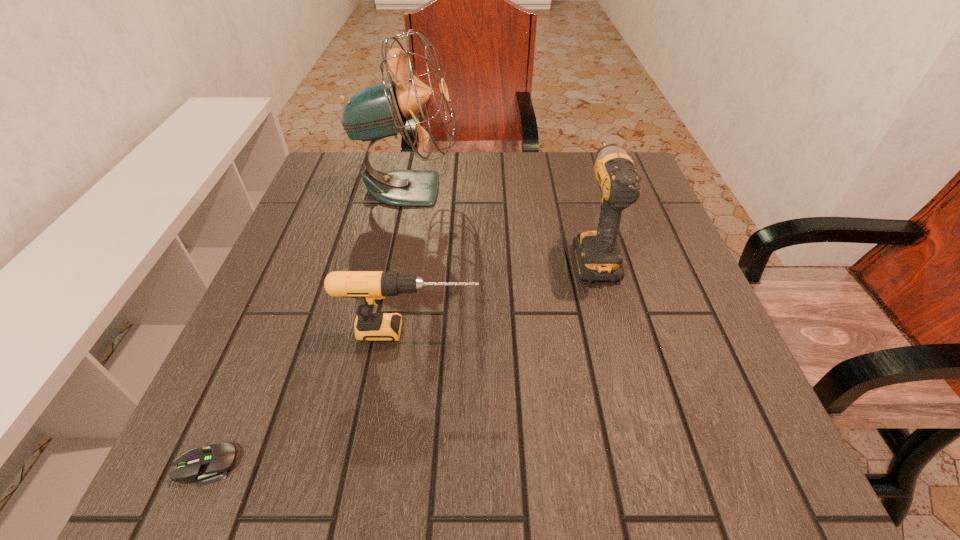
Locate an element on the screen. This screenshot has width=960, height=540. empty space that is in between the shortest object and the fan is located at coordinates (308, 326).

Locate an element on the screen. vacant space that's between the nearest object and the nearer drill is located at coordinates (309, 397).

Find the location of a particular element. The image size is (960, 540). empty location between the computer mouse and the farthest object is located at coordinates (308, 326).

You are a GUI agent. You are given a task and a screenshot of the screen. Output one action in this format:
    pyautogui.click(x=<x>, y=<y>)
    Task: Click on the free space between the rightmost object and the left drill
    This screenshot has height=540, width=960.
    Given the screenshot: What is the action you would take?
    pyautogui.click(x=502, y=293)

Where is `blank region between the rightmost object and the third tallest object`? This screenshot has height=540, width=960. blank region between the rightmost object and the third tallest object is located at coordinates (502, 293).

This screenshot has height=540, width=960. In order to click on vacant space that's between the farther drill and the shortest object in this screenshot , I will do [400, 359].

I want to click on object that ranks as the third closest to the taller drill, so click(x=210, y=464).

Point out which object is positioned as the third nearest to the second tallest object. Please provide its 2D coordinates. Your answer should be formatted as a tuple, i.e. [(x, y)], where the tuple contains the x and y coordinates of a point satisfying the conditions above.

[(210, 464)]

Where is `free spot that satisfies the following two spatial constraints: 1. on the front-facing side of the fan for air flow; 2. with the drill bit of the right drill facing forward`? free spot that satisfies the following two spatial constraints: 1. on the front-facing side of the fan for air flow; 2. with the drill bit of the right drill facing forward is located at coordinates (395, 254).

Identify the location of vacant space that satisfies the following two spatial constraints: 1. with the drill bit of the right drill facing forward; 2. on the front-facing side of the tallest object for air flow. (575, 188).